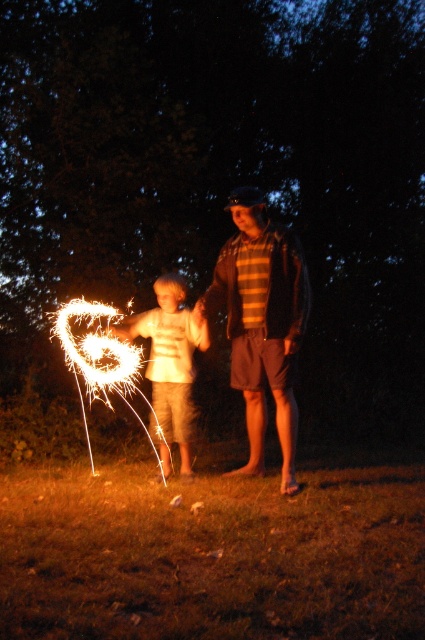
Looking at this image, you are a photographer trying to capture the sparkler in the child left hand. You need to focus your camera at the exact center of the scene. Is the striped cotton shirt at center located at the center of the scene?

The striped cotton shirt at center is located at point (260, 323), which is very close to the exact center of the scene. Therefore, focusing the camera at the exact center will also capture the striped cotton shirt at center sharply.

Based on the photo, you are organizing a charity event and need to arrange two shirts for a display. The striped cotton shirt at center and the white cotton shirt at center are both placed on a mannequin. Which shirt will require a wider display space?

The striped cotton shirt at center requires a wider display space because its width is larger than the white cotton shirt at center.

You are organizing a charity event and need to decide which shirt to donate. Both the striped cotton shirt at center and the white cotton shirt at center are available. Based on their sizes, which one would be more suitable for an adult male volunteer who prefers larger clothing?

The striped cotton shirt at center is bigger than the white cotton shirt at center, so it would be more suitable for an adult male volunteer who prefers larger clothing.